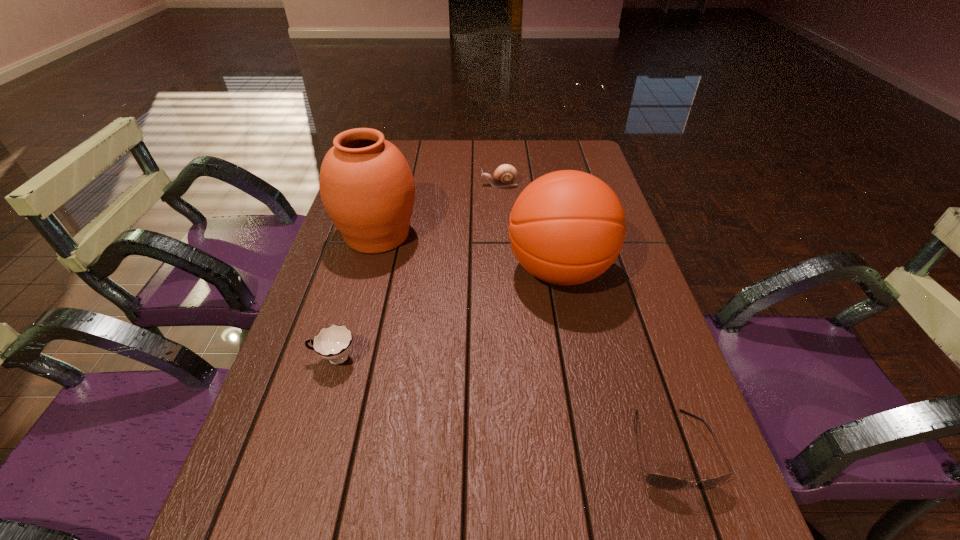
This screenshot has height=540, width=960. What are the coordinates of `the closest object to the farthest object` in the screenshot? It's located at (367, 188).

This screenshot has height=540, width=960. Identify the location of vacant space that satisfies the following two spatial constraints: 1. on the front-facing side of the basketball; 2. on the left side of the escargot. (505, 271).

At what (x,y) coordinates should I click in order to perform the action: click on vacant region that satisfies the following two spatial constraints: 1. on the side of the cup with the handle; 2. on the back side of the basketball. Please return your answer as a coordinate pair (x, y). Looking at the image, I should click on (360, 271).

Where is `vacant area that satisfies the following two spatial constraints: 1. on the side of the urn with the handle; 2. on the right side of the cup`? The height and width of the screenshot is (540, 960). vacant area that satisfies the following two spatial constraints: 1. on the side of the urn with the handle; 2. on the right side of the cup is located at coordinates (371, 235).

Identify the location of free point that satisfies the following two spatial constraints: 1. on the side of the basketball with the handle; 2. on the left side of the fourth farthest object. (360, 271).

I want to click on vacant position in the image that satisfies the following two spatial constraints: 1. on the back side of the basketball; 2. on the front-facing side of the escargot, so click(x=542, y=185).